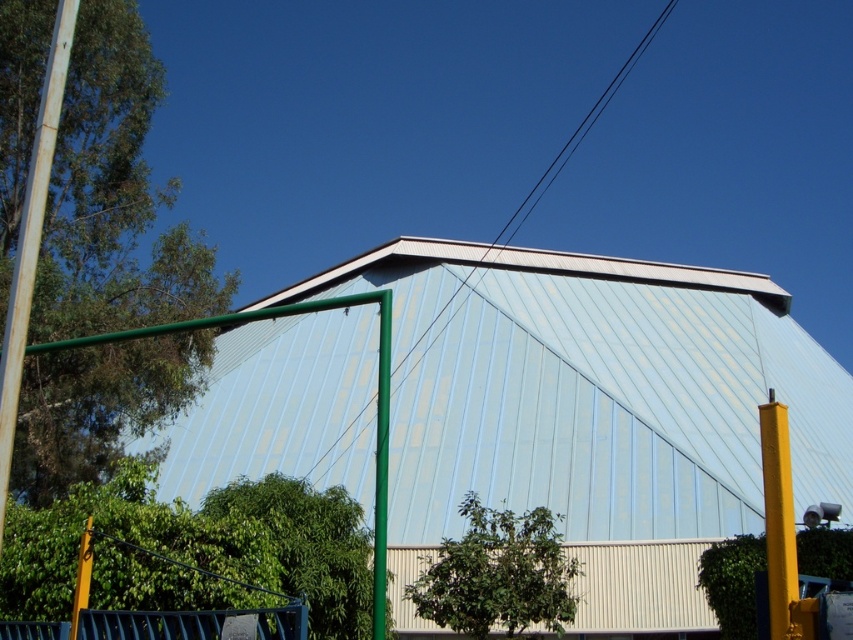
Does yellow metallic pole at right have a larger size compared to yellow matte pole at lower left?

Indeed, yellow metallic pole at right has a larger size compared to yellow matte pole at lower left.

Does yellow metallic pole at right have a greater height compared to yellow matte pole at lower left?

Yes, yellow metallic pole at right is taller than yellow matte pole at lower left.

You are a GUI agent. You are given a task and a screenshot of the screen. Output one action in this format:
    pyautogui.click(x=<x>, y=<y>)
    Task: Click on the yellow metallic pole at right
    
    Given the screenshot: What is the action you would take?
    pyautogui.click(x=780, y=525)

Is point (384, 584) positioned behind point (85, 566)?

No, (384, 584) is in front of (85, 566).

Does green matte pole at center appear on the right side of yellow matte pole at lower left?

Yes, green matte pole at center is to the right of yellow matte pole at lower left.

The width and height of the screenshot is (853, 640). Identify the location of green matte pole at center. (381, 461).

Can you confirm if yellow metallic pole at right is positioned above green matte pole at center?

No, yellow metallic pole at right is not above green matte pole at center.

Can you confirm if yellow metallic pole at right is bigger than green matte pole at center?

Yes.

Between point (778, 592) and point (386, 417), which one is positioned behind?

The point (386, 417) is more distant.

Image resolution: width=853 pixels, height=640 pixels. Identify the location of yellow metallic pole at right. (780, 525).